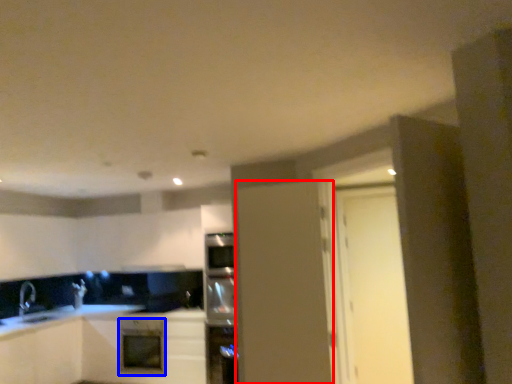
Question: Which point is further to the camera, door (highlighted by a red box) or oven (highlighted by a blue box)?

Choices:
 (A) door
 (B) oven

Answer: (B)